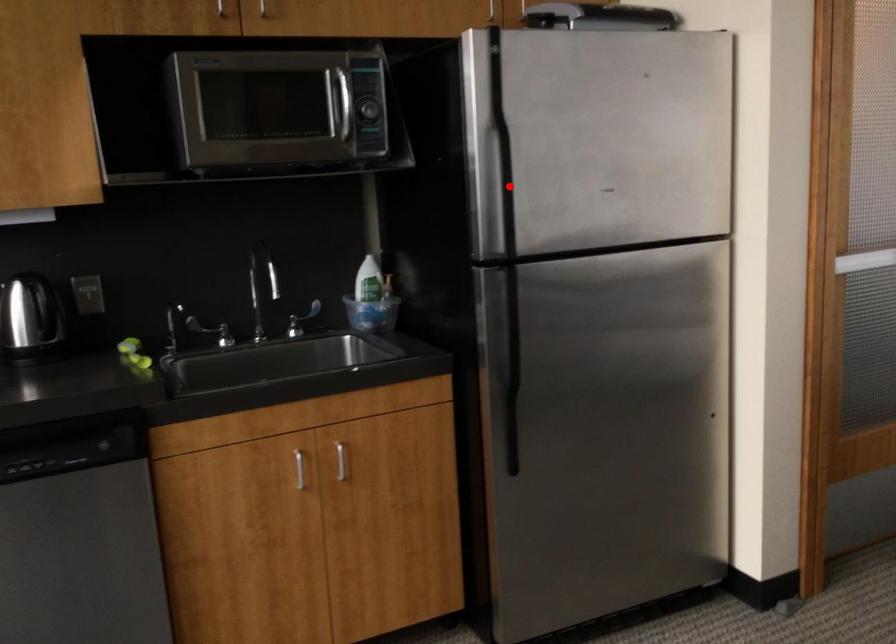
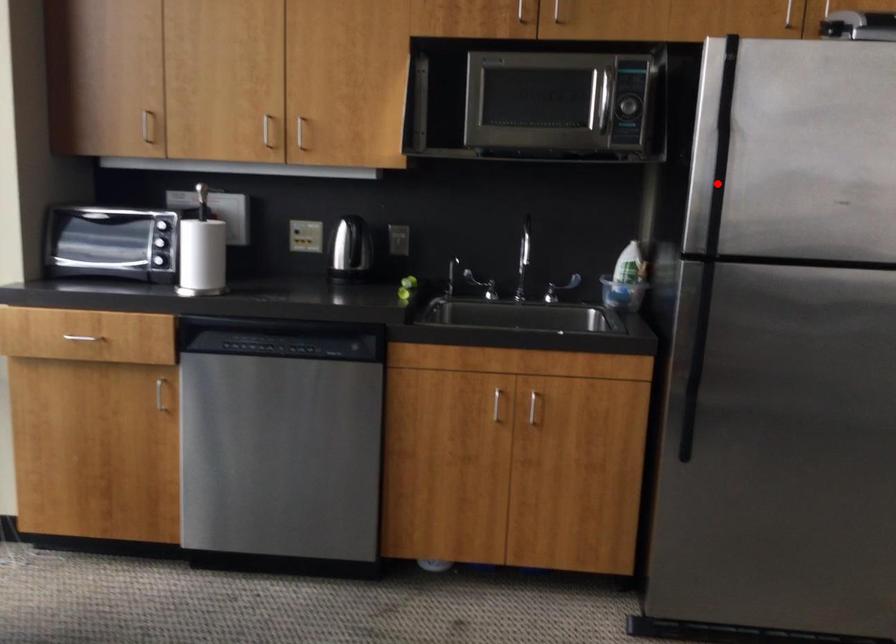
I am providing you with two images of the same scene from different viewpoints. A red point is marked on the first image and another point is marked on the second image. Do the highlighted points in image1 and image2 indicate the same real-world spot?

Yes